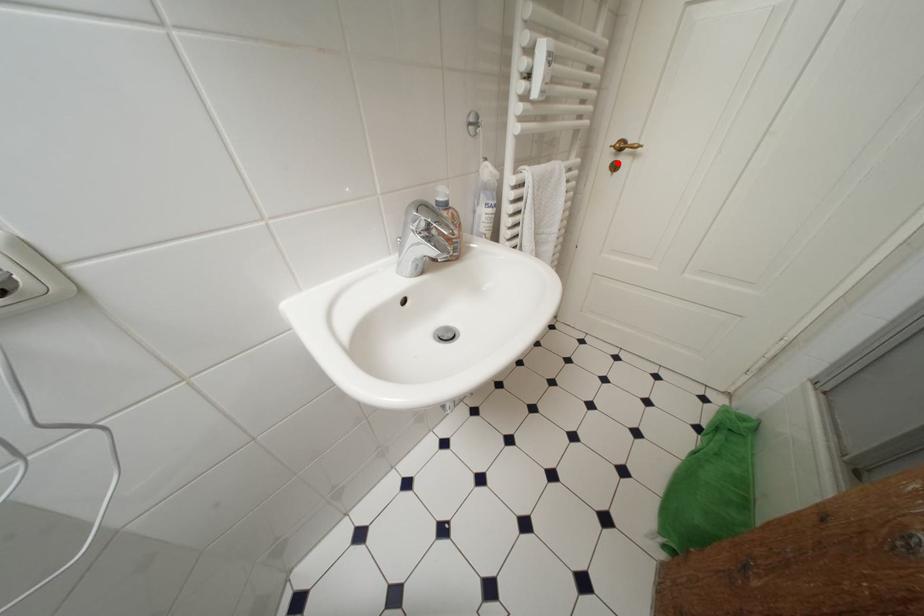
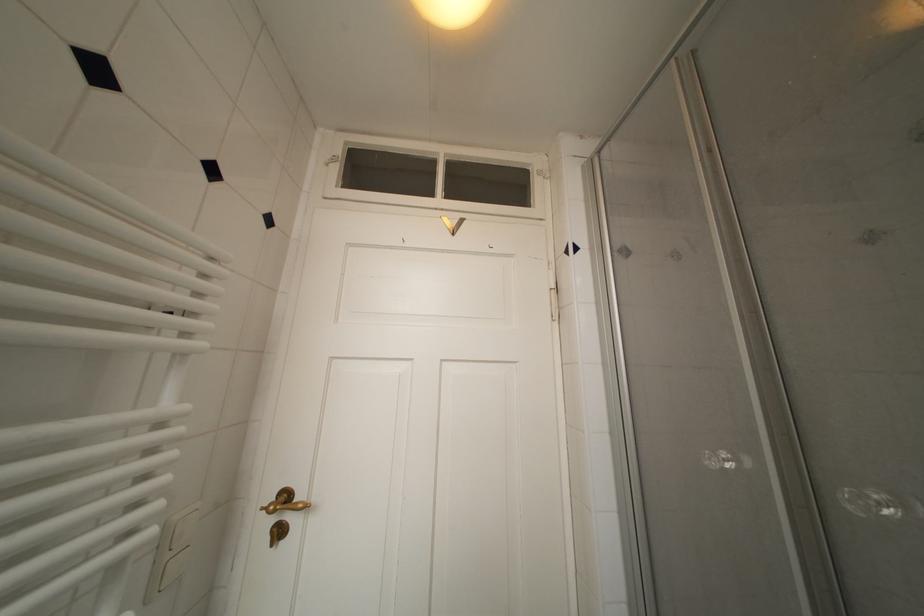
Locate, in the second image, the point that corresponds to the highlighted location in the first image.

(280, 524)